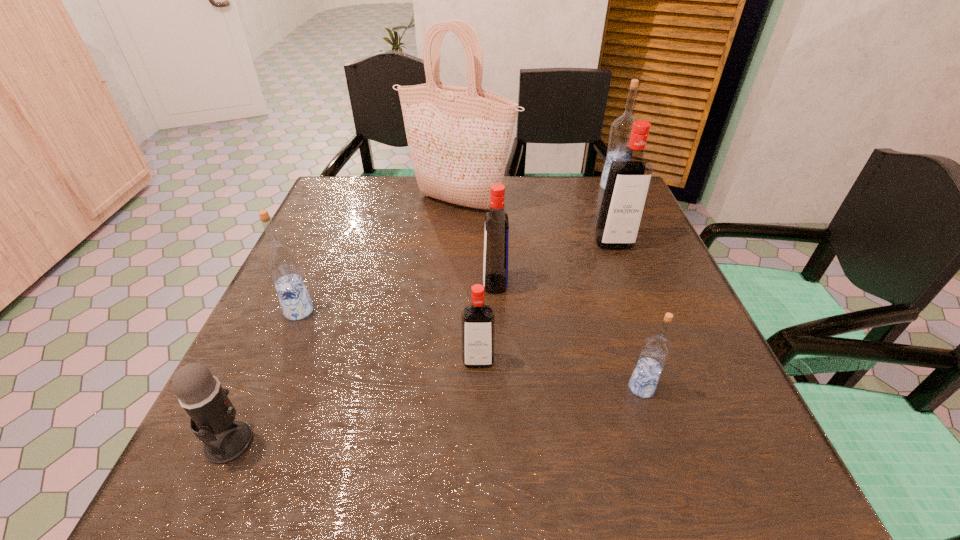
This screenshot has height=540, width=960. I want to click on shopping bag, so click(459, 137).

This screenshot has height=540, width=960. I want to click on the biggest blue vodka, so click(x=620, y=131).

This screenshot has width=960, height=540. I want to click on the rightmost blue vodka, so click(x=620, y=131).

This screenshot has height=540, width=960. I want to click on the farthest red vodka, so click(x=629, y=177).

The height and width of the screenshot is (540, 960). Identify the location of the rightmost red vodka. (629, 177).

Image resolution: width=960 pixels, height=540 pixels. Find the location of `the second smallest red vodka`. the second smallest red vodka is located at coordinates (496, 238).

Where is `the fifth nearest object`? Image resolution: width=960 pixels, height=540 pixels. the fifth nearest object is located at coordinates (496, 238).

This screenshot has height=540, width=960. What are the coordinates of `the second biggest blue vodka` in the screenshot? It's located at (280, 260).

Where is `the fifth farthest object`? the fifth farthest object is located at coordinates (280, 260).

At what (x,y) coordinates should I click in order to perform the action: click on the second nearest vodka. Please return your answer as a coordinate pair (x, y). This screenshot has width=960, height=540. Looking at the image, I should click on (477, 320).